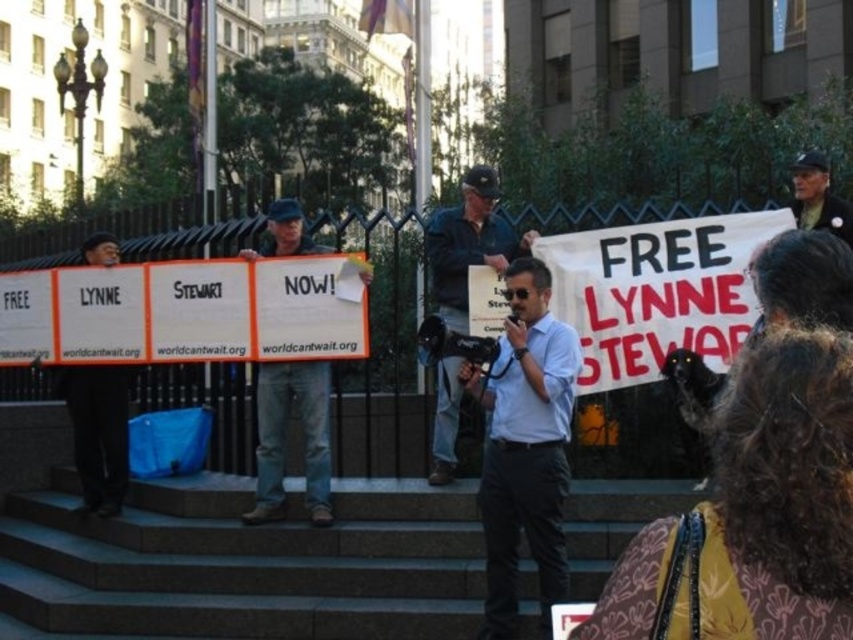
The image size is (853, 640). Identify the location of gray stone stairs at center. (242, 563).

Where is `gray stone stairs at center`? gray stone stairs at center is located at coordinates (242, 563).

Is point (289, 621) closer to camera compared to point (480, 227)?

Yes, it is.

Is point (0, 596) more distant than point (434, 246)?

No, (0, 596) is closer to viewer.

Between point (431, 506) and point (485, 248), which one is positioned in front?

Point (431, 506) is more forward.

This screenshot has height=640, width=853. I want to click on gray stone stairs at center, so click(242, 563).

Is point (463, 369) behind point (814, 209)?

No, it is not.

What do you see at coordinates (525, 445) in the screenshot? The height and width of the screenshot is (640, 853). I see `light blue shirt at center` at bounding box center [525, 445].

Between point (519, 412) and point (817, 157), which one is positioned behind?

The point (817, 157) is behind.

I want to click on light blue shirt at center, so click(525, 445).